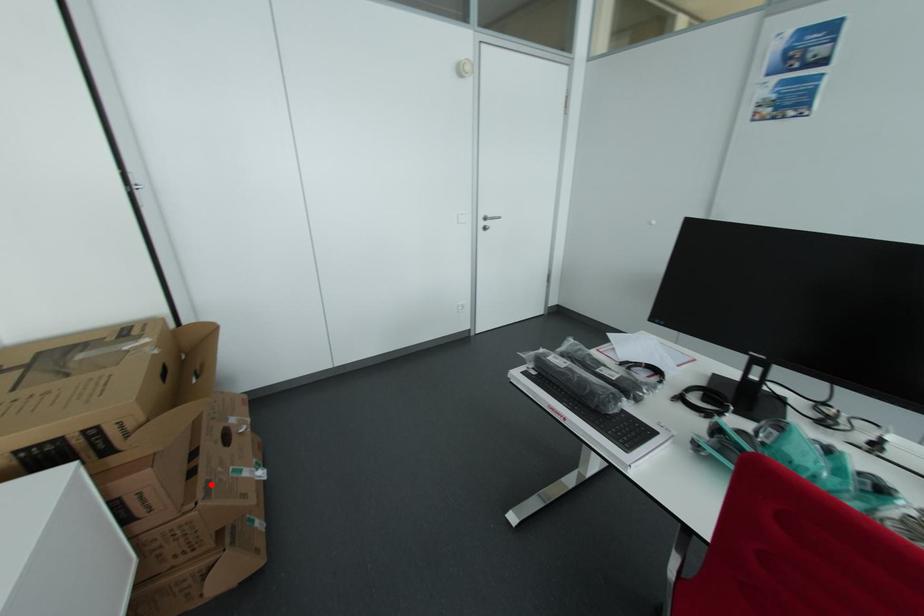
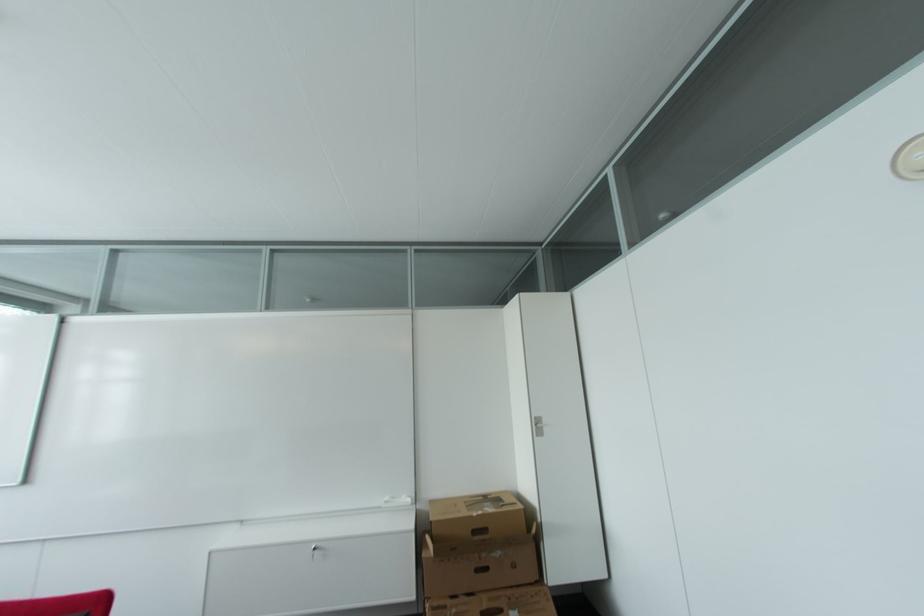
Locate, in the second image, the point that corresponds to the highlighted location in the first image.

(448, 609)